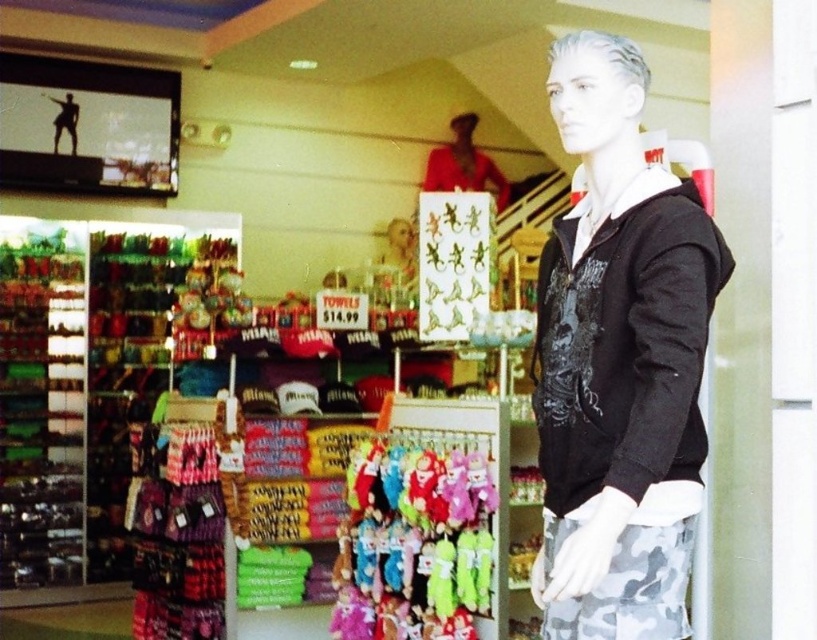
Between black matte hoodie at center and matte red shirt at upper center, which one appears on the left side from the viewer's perspective?

black matte hoodie at center

This screenshot has width=817, height=640. What do you see at coordinates (619, 362) in the screenshot?
I see `black matte hoodie at center` at bounding box center [619, 362].

Find the location of `black matte hoodie at center`. black matte hoodie at center is located at coordinates (619, 362).

Does velvet plush toys at center appear over matte red shirt at upper center?

No, velvet plush toys at center is not above matte red shirt at upper center.

Can you confirm if velvet plush toys at center is positioned to the left of matte red shirt at upper center?

Correct, you'll find velvet plush toys at center to the left of matte red shirt at upper center.

This screenshot has height=640, width=817. In order to click on velvet plush toys at center in this screenshot , I will do `click(413, 544)`.

Does black matte hoodie at center have a lesser width compared to velvet plush toys at center?

Correct, black matte hoodie at center's width is less than velvet plush toys at center's.

Between black matte hoodie at center and velvet plush toys at center, which one has more height?

Standing taller between the two is black matte hoodie at center.

Is point (601, 108) farther from camera compared to point (467, 573)?

No.

The height and width of the screenshot is (640, 817). I want to click on black matte hoodie at center, so click(619, 362).